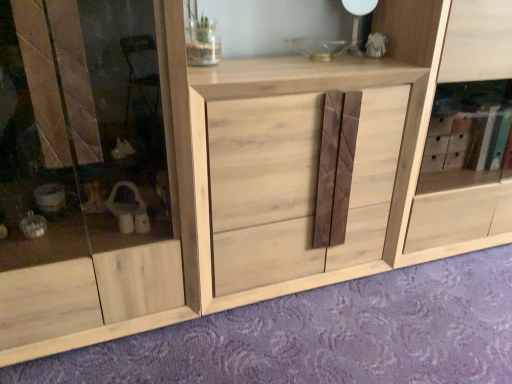
Question: Is the depth of natural wood cabinet at center less than that of natural wood cabinet at center?

Choices:
 (A) no
 (B) yes

Answer: (A)

Question: From a real-world perspective, is natural wood cabinet at center positioned under natural wood cabinet at center based on gravity?

Choices:
 (A) no
 (B) yes

Answer: (A)

Question: From the image's perspective, does natural wood cabinet at center appear higher than natural wood cabinet at center?

Choices:
 (A) yes
 (B) no

Answer: (A)

Question: Does natural wood cabinet at center have a greater height compared to natural wood cabinet at center?

Choices:
 (A) yes
 (B) no

Answer: (B)

Question: Is natural wood cabinet at center not close to natural wood cabinet at center?

Choices:
 (A) yes
 (B) no

Answer: (A)

Question: Is natural wood cabinet at center to the left of natural wood cabinet at center from the viewer's perspective?

Choices:
 (A) no
 (B) yes

Answer: (A)

Question: Is natural wood drawer at center shorter than natural wood cabinet at center?

Choices:
 (A) no
 (B) yes

Answer: (B)

Question: Does natural wood drawer at center have a lesser width compared to natural wood cabinet at center?

Choices:
 (A) yes
 (B) no

Answer: (A)

Question: Is natural wood drawer at center to the left of natural wood cabinet at center from the viewer's perspective?

Choices:
 (A) no
 (B) yes

Answer: (A)

Question: Is natural wood drawer at center far away from natural wood cabinet at center?

Choices:
 (A) no
 (B) yes

Answer: (A)

Question: Is natural wood cabinet at center completely or partially inside natural wood drawer at center?

Choices:
 (A) yes
 (B) no

Answer: (B)

Question: Is natural wood drawer at center positioned with its back to natural wood cabinet at center?

Choices:
 (A) no
 (B) yes

Answer: (A)

Question: Would you say natural wood cabinet at center is part of natural wood drawer at center's contents?

Choices:
 (A) yes
 (B) no

Answer: (B)